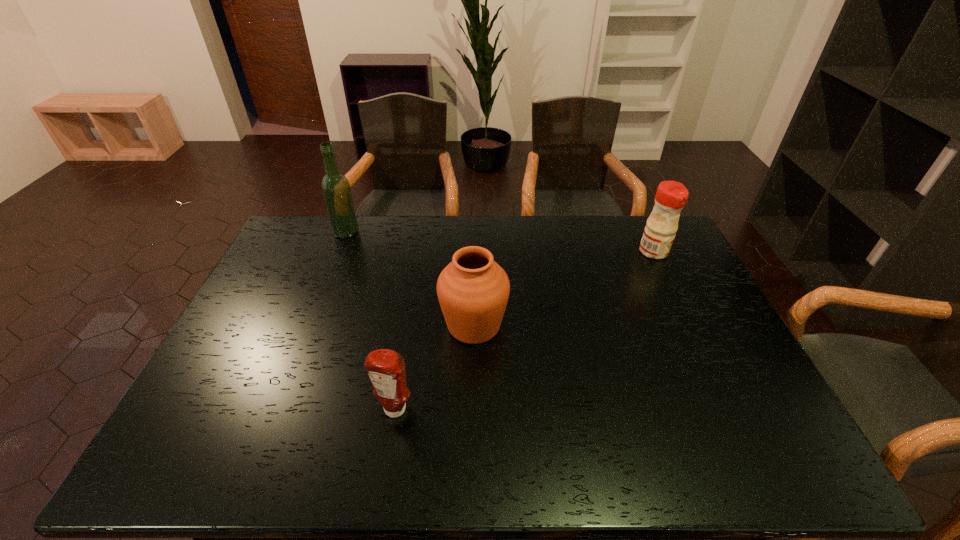
Identify the location of the farthest object. Image resolution: width=960 pixels, height=540 pixels. (336, 189).

What are the coordinates of `the tallest object` in the screenshot? It's located at (336, 189).

Locate an element on the screen. the third nearest object is located at coordinates (671, 196).

At what (x,y) coordinates should I click in order to perform the action: click on the taller condiment. Please return your answer as a coordinate pair (x, y). Looking at the image, I should click on (671, 196).

Find the location of a particular element. The height and width of the screenshot is (540, 960). the third farthest object is located at coordinates (473, 290).

Locate an element on the screen. The height and width of the screenshot is (540, 960). the third object from left to right is located at coordinates (473, 290).

Image resolution: width=960 pixels, height=540 pixels. I want to click on the left condiment, so point(386,368).

This screenshot has height=540, width=960. I want to click on the shortest object, so click(x=386, y=368).

Find the location of a particular element. This screenshot has height=540, width=960. vacant region located on the back of the farthest object is located at coordinates (352, 217).

The width and height of the screenshot is (960, 540). What are the coordinates of `vacant position located 0.180m on the left of the rightmost object` in the screenshot? It's located at (x=588, y=252).